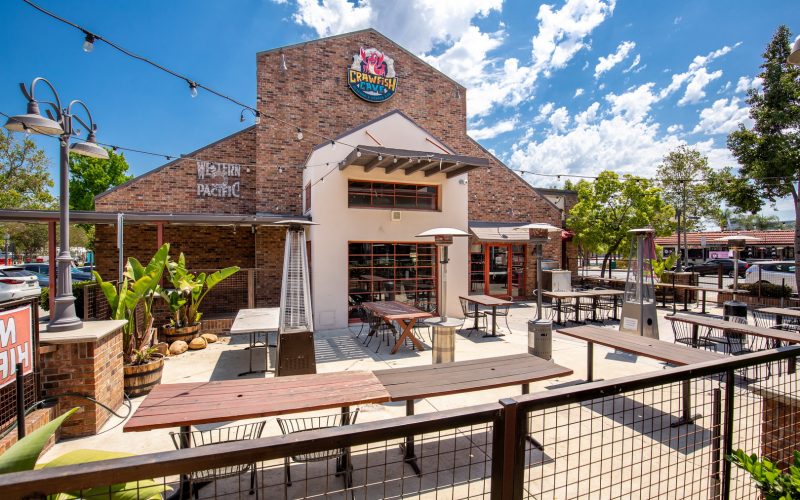
You are a GUI agent. You are given a task and a screenshot of the screen. Output one action in this format:
    pyautogui.click(x=<x>, y=<y>)
    Task: Click on the window
    This screenshot has width=800, height=500.
    Given the screenshot: What is the action you would take?
    pyautogui.click(x=406, y=282)